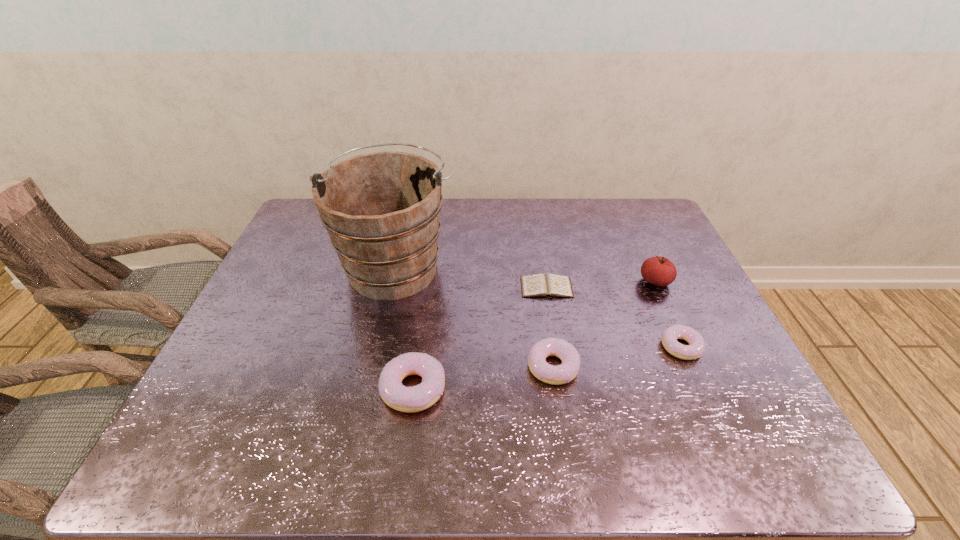
At what (x,y) coordinates should I click in order to perform the action: click on the fourth shortest object. Please return your answer as a coordinate pair (x, y). Looking at the image, I should click on (397, 396).

This screenshot has width=960, height=540. Identify the location of the leftmost doughnut. (397, 396).

Where is `the second doughnut from left to right`? Image resolution: width=960 pixels, height=540 pixels. the second doughnut from left to right is located at coordinates (565, 372).

Where is `the second tallest doughnut`? the second tallest doughnut is located at coordinates (565, 372).

Where is `the second shortest object`? the second shortest object is located at coordinates (696, 347).

I want to click on the shortest doughnut, so click(x=696, y=347).

You are a GUI agent. You are given a task and a screenshot of the screen. Output one action in this format:
    pyautogui.click(x=<x>, y=<y>)
    Task: Click on the tallest object
    
    Given the screenshot: What is the action you would take?
    pyautogui.click(x=381, y=210)

Identify the location of the shortest object. (548, 285).

The width and height of the screenshot is (960, 540). Find the location of `tomato`. tomato is located at coordinates (659, 271).

In order to click on vacant space located on the back of the tallest doughnut in this screenshot , I will do `click(427, 288)`.